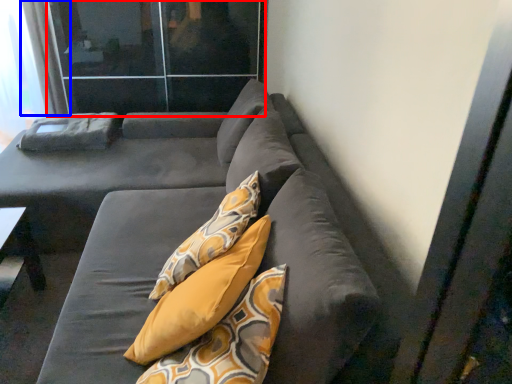
Question: Which point is further to the camera, screen door (highlighted by a red box) or curtain (highlighted by a blue box)?

Choices:
 (A) screen door
 (B) curtain

Answer: (B)